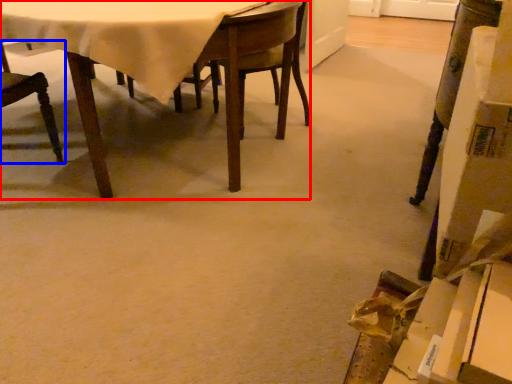
Question: Which of the following is the closest to the observer, table (highlighted by a red box) or chair (highlighted by a blue box)?

Choices:
 (A) table
 (B) chair

Answer: (A)